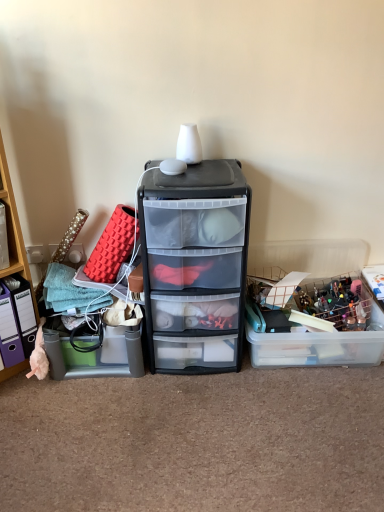
Question: From the image's perspective, does translucent plastic storage box at right, arranged as the second storage box when viewed from the left, appear higher than translucent plastic storage box at left, which appears as the 1th storage box when viewed from the left?

Choices:
 (A) no
 (B) yes

Answer: (B)

Question: Is translucent plastic storage box at right, the first storage box viewed from the right, aimed at translucent plastic storage box at left, which is counted as the 2th storage box, starting from the right?

Choices:
 (A) yes
 (B) no

Answer: (B)

Question: Does translucent plastic storage box at right, the first storage box viewed from the right, have a greater width compared to translucent plastic storage box at left, which is counted as the 2th storage box, starting from the right?

Choices:
 (A) yes
 (B) no

Answer: (A)

Question: Is translucent plastic storage box at right, the first storage box viewed from the right, smaller than translucent plastic storage box at left, which is counted as the 2th storage box, starting from the right?

Choices:
 (A) yes
 (B) no

Answer: (B)

Question: Does translucent plastic storage box at right, the first storage box viewed from the right, have a lesser width compared to translucent plastic storage box at left, which is counted as the 2th storage box, starting from the right?

Choices:
 (A) yes
 (B) no

Answer: (B)

Question: Does translucent plastic storage box at right, the first storage box viewed from the right, appear on the left side of translucent plastic storage box at left, which appears as the 1th storage box when viewed from the left?

Choices:
 (A) yes
 (B) no

Answer: (B)

Question: Can you confirm if transparent plastic drawer at center is smaller than translucent plastic storage box at right, arranged as the second storage box when viewed from the left?

Choices:
 (A) yes
 (B) no

Answer: (B)

Question: Can you confirm if transparent plastic drawer at center is taller than translucent plastic storage box at right, the first storage box viewed from the right?

Choices:
 (A) yes
 (B) no

Answer: (A)

Question: From the image's perspective, is transparent plastic drawer at center on top of translucent plastic storage box at right, arranged as the second storage box when viewed from the left?

Choices:
 (A) no
 (B) yes

Answer: (B)

Question: Is transparent plastic drawer at center oriented towards translucent plastic storage box at right, the first storage box viewed from the right?

Choices:
 (A) yes
 (B) no

Answer: (B)

Question: Is transparent plastic drawer at center looking in the opposite direction of translucent plastic storage box at right, arranged as the second storage box when viewed from the left?

Choices:
 (A) yes
 (B) no

Answer: (B)

Question: From a real-world perspective, is transparent plastic drawer at center below translucent plastic storage box at right, arranged as the second storage box when viewed from the left?

Choices:
 (A) no
 (B) yes

Answer: (A)

Question: Can you confirm if transparent plastic drawer at center is positioned to the right of translucent plastic storage box at left, which appears as the 1th storage box when viewed from the left?

Choices:
 (A) yes
 (B) no

Answer: (A)